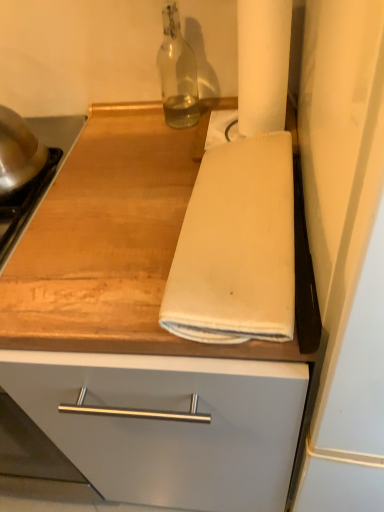
Locate an element on the screen. Image resolution: width=384 pixels, height=512 pixels. vacant space situated on the left part of white cotton towel at center is located at coordinates (100, 250).